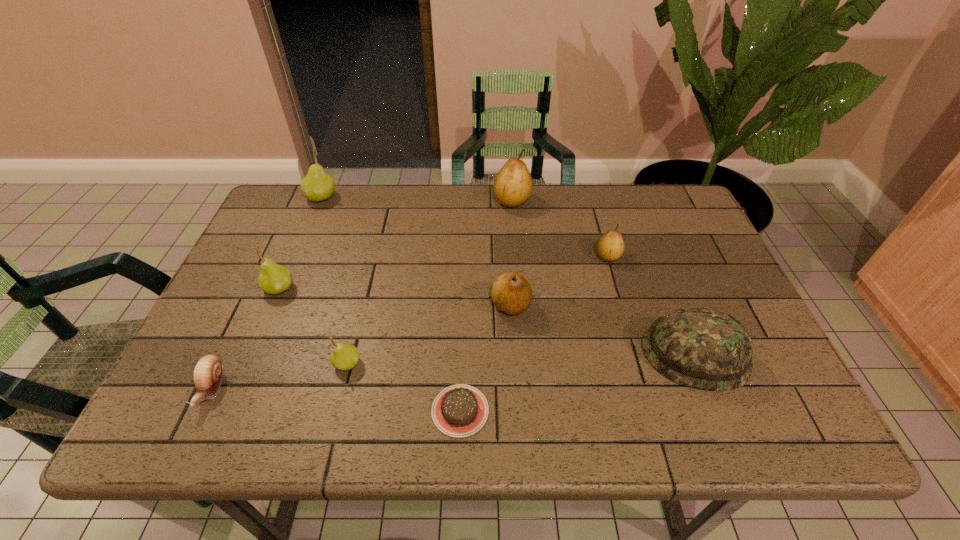
The width and height of the screenshot is (960, 540). I want to click on chocolate cake, so click(x=460, y=410).

The image size is (960, 540). What are the coordinates of `the fifth object from left to right` in the screenshot? It's located at (460, 410).

Find the location of a particular element. vacant area situated 0.150m on the left of the farthest brown pear is located at coordinates (445, 200).

Find the location of a particular element. This screenshot has width=960, height=540. free region located on the right of the farthest green pear is located at coordinates (394, 197).

Where is `free region located on the front of the second farthest green pear`? free region located on the front of the second farthest green pear is located at coordinates (218, 431).

You are a GUI agent. You are given a task and a screenshot of the screen. Output one action in this format:
    pyautogui.click(x=<x>, y=<y>)
    Task: Click on the vacant space located 0.150m on the left of the second smallest brown pear
    
    Given the screenshot: What is the action you would take?
    pyautogui.click(x=430, y=305)

Identify the location of free space located 0.200m on the back of the headwear. (658, 263).

At what (x,y) coordinates should I click in order to perform the action: click on free location located on the left of the seventh nearest object. Please return your answer as a coordinate pair (x, y). Looking at the image, I should click on (533, 256).

Identify the location of free space located 0.050m on the right of the rightmost green pear. This screenshot has width=960, height=540. (384, 363).

Identify the location of vacant space located 0.380m on the left of the fifth object from right to left. (244, 410).